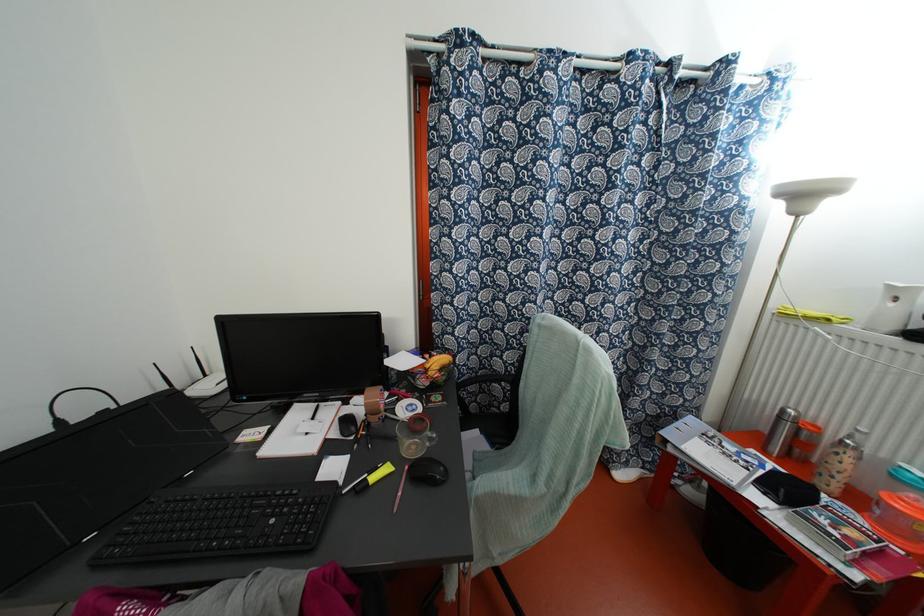
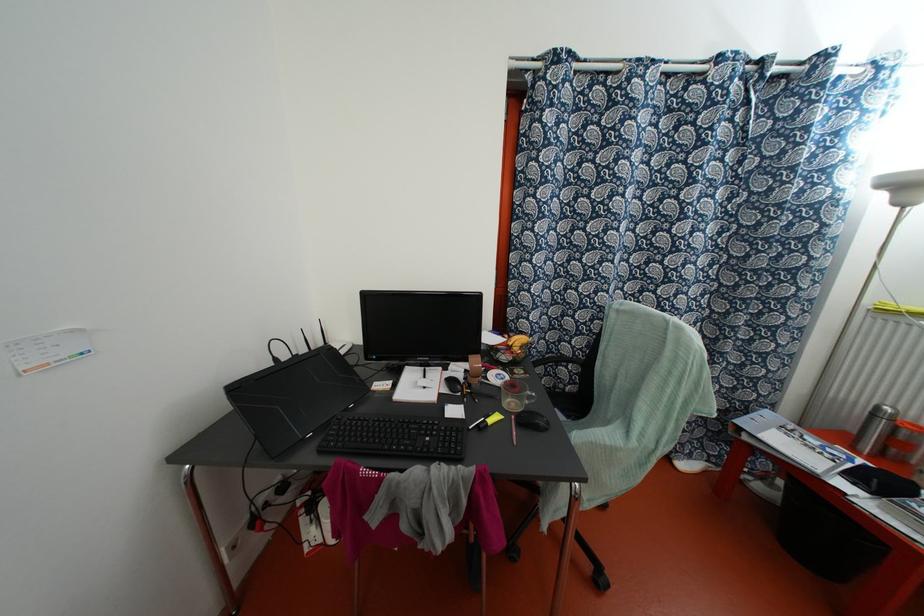
The point at (779, 416) is marked in the first image. Where is the corresponding point in the second image?

(872, 415)